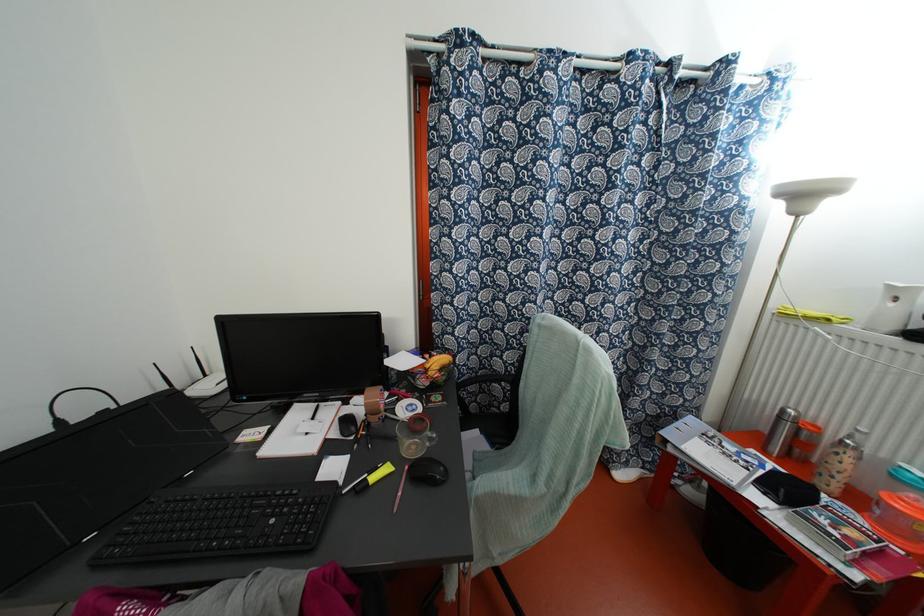
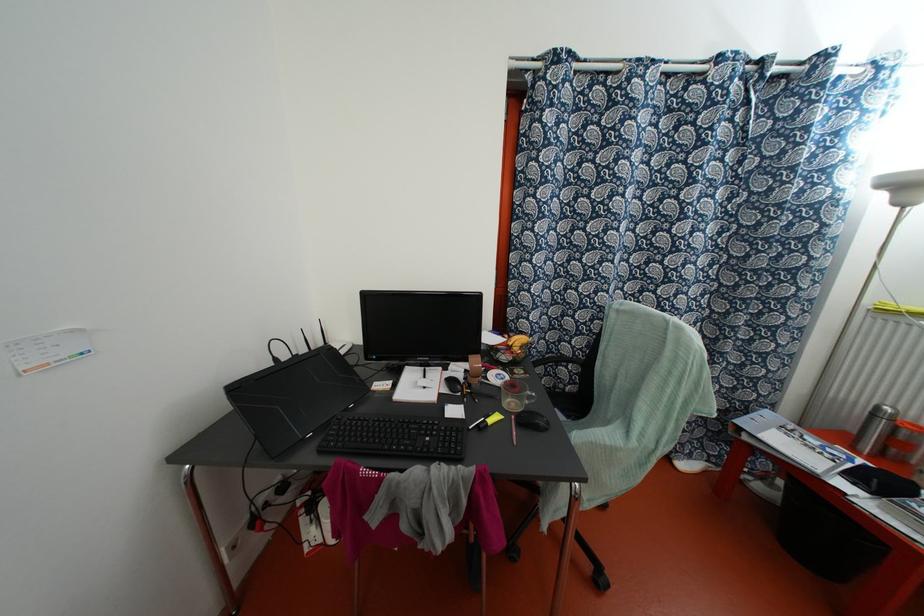
The point at (779, 416) is marked in the first image. Where is the corresponding point in the second image?

(872, 415)